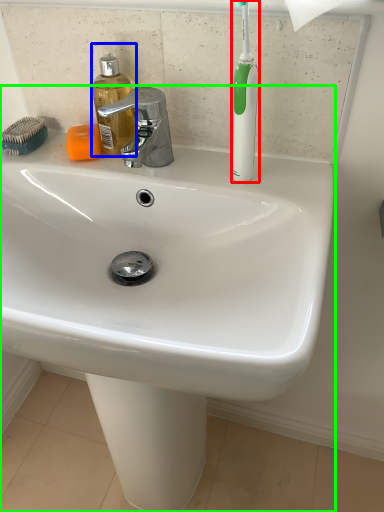
Question: Estimate the real-world distances between objects in this image. Which object is closer to toothbrush (highlighted by a red box), soap dispenser (highlighted by a blue box) or sink (highlighted by a green box)?

Choices:
 (A) soap dispenser
 (B) sink

Answer: (A)